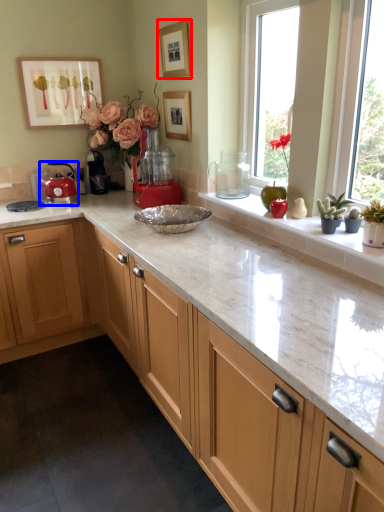
Question: Which point is closer to the camera, picture frame (highlighted by a red box) or kitchen appliance (highlighted by a blue box)?

Choices:
 (A) picture frame
 (B) kitchen appliance

Answer: (A)